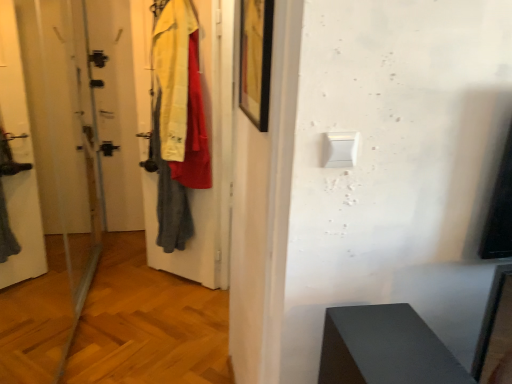
Question: Is transparent glass screen door at left wider than black matte picture frame at upper center?

Choices:
 (A) no
 (B) yes

Answer: (B)

Question: Can you confirm if transparent glass screen door at left is bigger than black matte picture frame at upper center?

Choices:
 (A) yes
 (B) no

Answer: (A)

Question: From the image's perspective, would you say transparent glass screen door at left is positioned over black matte picture frame at upper center?

Choices:
 (A) no
 (B) yes

Answer: (A)

Question: Considering the relative positions of transparent glass screen door at left and black matte picture frame at upper center in the image provided, is transparent glass screen door at left to the left of black matte picture frame at upper center from the viewer's perspective?

Choices:
 (A) no
 (B) yes

Answer: (B)

Question: From a real-world perspective, is transparent glass screen door at left positioned over black matte picture frame at upper center based on gravity?

Choices:
 (A) yes
 (B) no

Answer: (B)

Question: Is transparent glass screen door at left bigger or smaller than white plastic light switch at upper center?

Choices:
 (A) big
 (B) small

Answer: (A)

Question: Is transparent glass screen door at left taller or shorter than white plastic light switch at upper center?

Choices:
 (A) tall
 (B) short

Answer: (A)

Question: From a real-world perspective, relative to white plastic light switch at upper center, is transparent glass screen door at left vertically above or below?

Choices:
 (A) above
 (B) below

Answer: (B)

Question: Is transparent glass screen door at left in front of or behind white plastic light switch at upper center in the image?

Choices:
 (A) behind
 (B) front

Answer: (B)

Question: Considering the relative positions of white plastic light switch at upper center and black matte picture frame at upper center in the image provided, is white plastic light switch at upper center to the left or to the right of black matte picture frame at upper center?

Choices:
 (A) right
 (B) left

Answer: (A)

Question: Is point (328, 139) positioned closer to the camera than point (246, 3)?

Choices:
 (A) farther
 (B) closer

Answer: (B)

Question: From the image's perspective, relative to black matte picture frame at upper center, is white plastic light switch at upper center above or below?

Choices:
 (A) below
 (B) above

Answer: (A)

Question: Is white plastic light switch at upper center in front of or behind black matte picture frame at upper center in the image?

Choices:
 (A) behind
 (B) front

Answer: (B)

Question: From the image's perspective, is black matte picture frame at upper center located above or below white plastic light switch at upper center?

Choices:
 (A) above
 (B) below

Answer: (A)

Question: Is point (241, 43) positioned closer to the camera than point (345, 150)?

Choices:
 (A) farther
 (B) closer

Answer: (A)